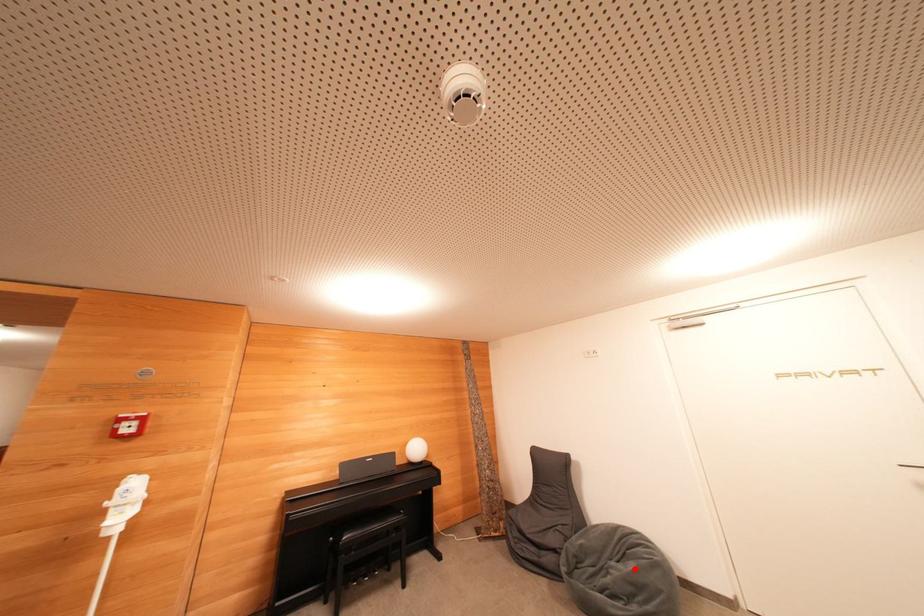
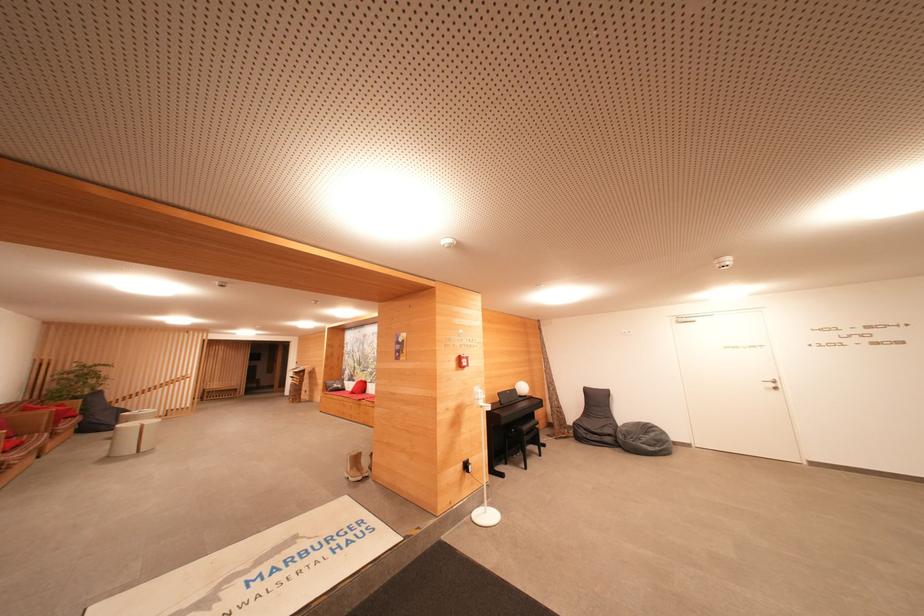
Question: I am providing you with two images of the same scene from different viewpoints. Given a red point in image1, look at the same physical point in image2. Is it:

Choices:
 (A) Closer to the viewpoint
 (B) Farther from the viewpoint

Answer: (B)